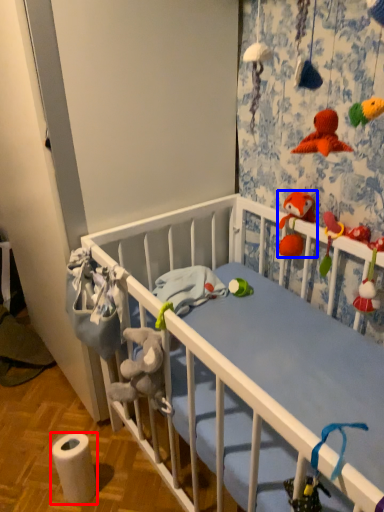
Question: Which point is closer to the camera, toilet paper (highlighted by a red box) or toy (highlighted by a blue box)?

Choices:
 (A) toilet paper
 (B) toy

Answer: (A)